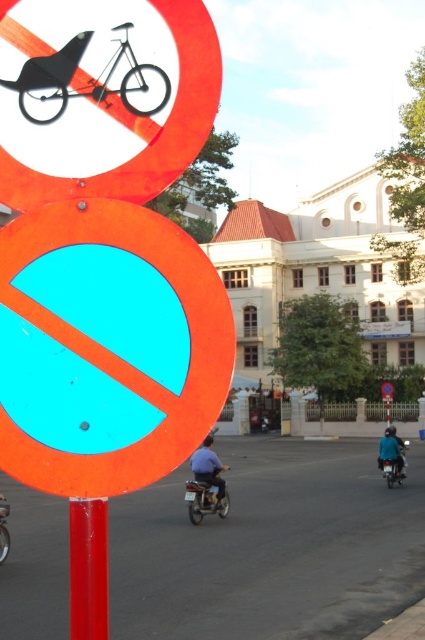
Question: Which point is closer to the camera?

Choices:
 (A) (201, 484)
 (B) (71, 90)

Answer: (B)

Question: Observing the image, what is the correct spatial positioning of orange matte circle at center in reference to teal matte helmet at center?

Choices:
 (A) left
 (B) right

Answer: (A)

Question: Which point is closer to the camera taking this photo?

Choices:
 (A) pyautogui.click(x=167, y=136)
 (B) pyautogui.click(x=113, y=200)

Answer: (B)

Question: Estimate the real-world distances between objects in this image. Which object is closer to the metallic silver motorcycle at center?

Choices:
 (A) orange matte circle at center
 (B) matte black bicycle at upper left
 (C) black matte bicycle at upper left

Answer: (A)

Question: Does black matte bicycle at upper left appear under blue fabric shirt at center?

Choices:
 (A) yes
 (B) no

Answer: (B)

Question: Does metallic blue motorcycle at center appear over metallic silver motorcycle at center?

Choices:
 (A) no
 (B) yes

Answer: (A)